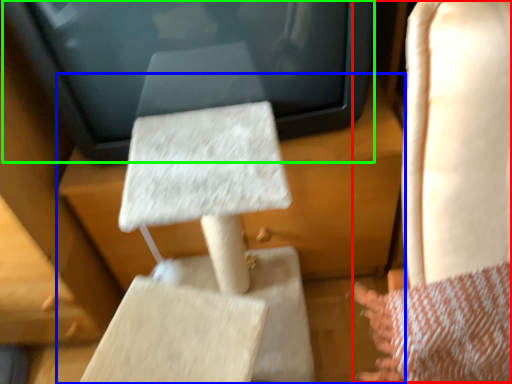
Question: Considering the real-world distances, which object is closest to rocking chair (highlighted by a red box)? furniture (highlighted by a blue box) or electronic (highlighted by a green box).

Choices:
 (A) furniture
 (B) electronic

Answer: (B)